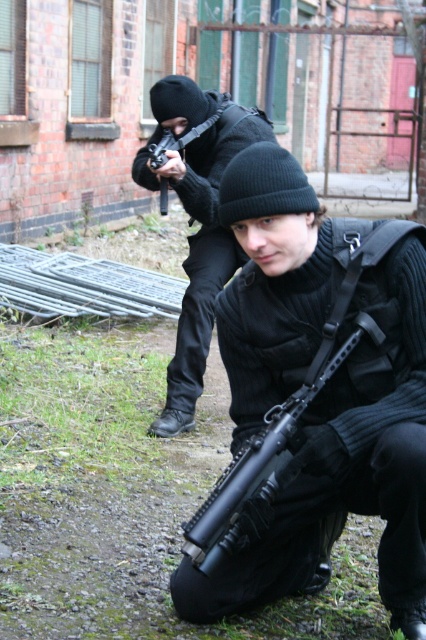
Question: From the image, what is the correct spatial relationship of matte black rifle at center in relation to black matte rifle at center?

Choices:
 (A) left
 (B) right

Answer: (A)

Question: Can you confirm if matte black rifle at center is positioned to the right of black matte rifle at center?

Choices:
 (A) no
 (B) yes

Answer: (A)

Question: Which of the following is the closest to the observer?

Choices:
 (A) (207, 499)
 (B) (218, 260)

Answer: (A)

Question: Considering the relative positions of matte black rifle at center and black matte rifle at center in the image provided, where is matte black rifle at center located with respect to black matte rifle at center?

Choices:
 (A) left
 (B) right

Answer: (A)